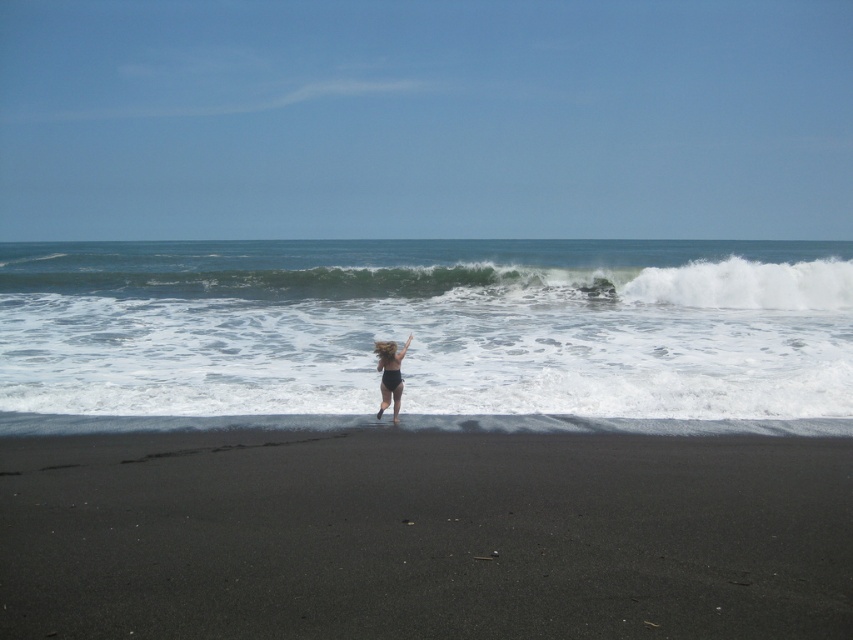
Question: Among these points, which one is nearest to the camera?

Choices:
 (A) (286, 291)
 (B) (711, 257)
 (C) (384, 353)

Answer: (C)

Question: Is white frothy wave at upper center positioned at the back of black matte swimsuit at center?

Choices:
 (A) yes
 (B) no

Answer: (A)

Question: Based on their relative distances, which object is farther from the white frothy wave at center?

Choices:
 (A) white frothy wave at upper center
 (B) black sand at lower center
 (C) black matte swimsuit at center

Answer: (B)

Question: Is white frothy wave at center to the right of black matte swimsuit at center from the viewer's perspective?

Choices:
 (A) yes
 (B) no

Answer: (B)

Question: Is white frothy wave at center to the left of black matte swimsuit at center from the viewer's perspective?

Choices:
 (A) yes
 (B) no

Answer: (A)

Question: Which point is closer to the camera?

Choices:
 (A) black matte swimsuit at center
 (B) white frothy wave at center
 (C) white frothy wave at upper center
 (D) black sand at lower center

Answer: (D)